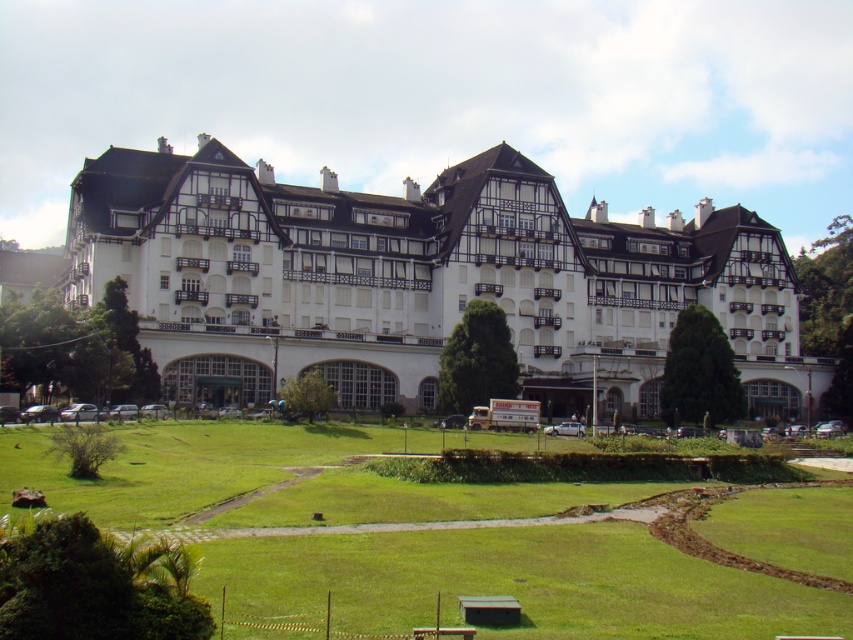
Who is taller, white wooden hotel at center or green grass at center?

With more height is white wooden hotel at center.

Can you confirm if white wooden hotel at center is wider than green grass at center?

Yes, white wooden hotel at center is wider than green grass at center.

Is point (404, 256) farther from viewer compared to point (262, 545)?

Yes, point (404, 256) is farther from viewer.

Locate an element on the screen. white wooden hotel at center is located at coordinates (425, 280).